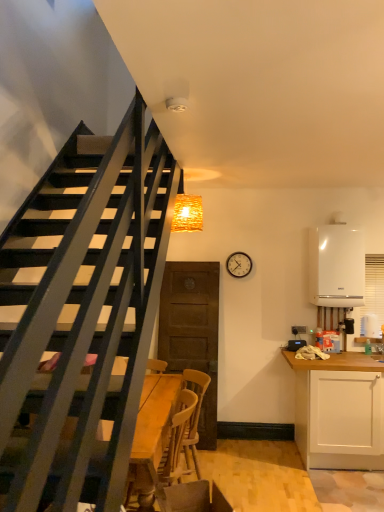
Question: Could you tell me if woven wood light fixture at upper center is turned towards metallic round clock at upper right?

Choices:
 (A) yes
 (B) no

Answer: (B)

Question: Is woven wood light fixture at upper center oriented away from metallic round clock at upper right?

Choices:
 (A) no
 (B) yes

Answer: (A)

Question: Is metallic round clock at upper right a part of woven wood light fixture at upper center?

Choices:
 (A) no
 (B) yes

Answer: (A)

Question: Does woven wood light fixture at upper center have a lesser height compared to metallic round clock at upper right?

Choices:
 (A) yes
 (B) no

Answer: (B)

Question: Is woven wood light fixture at upper center behind metallic round clock at upper right?

Choices:
 (A) yes
 (B) no

Answer: (B)

Question: From the image's perspective, is wooden swivel chair at lower center positioned above or below metallic round clock at upper right?

Choices:
 (A) below
 (B) above

Answer: (A)

Question: Is point click(220, 495) positioned closer to the camera than point click(248, 257)?

Choices:
 (A) farther
 (B) closer

Answer: (B)

Question: Considering the relative positions of wooden swivel chair at lower center and metallic round clock at upper right in the image provided, is wooden swivel chair at lower center to the left or to the right of metallic round clock at upper right?

Choices:
 (A) right
 (B) left

Answer: (B)

Question: Do you think wooden swivel chair at lower center is within metallic round clock at upper right, or outside of it?

Choices:
 (A) outside
 (B) inside

Answer: (A)

Question: Considering the relative positions of metallic round clock at upper right and white matte cabinet at right in the image provided, is metallic round clock at upper right to the left or to the right of white matte cabinet at right?

Choices:
 (A) right
 (B) left

Answer: (B)

Question: Is metallic round clock at upper right situated inside white matte cabinet at right or outside?

Choices:
 (A) inside
 (B) outside

Answer: (B)

Question: Is metallic round clock at upper right bigger or smaller than white matte cabinet at right?

Choices:
 (A) small
 (B) big

Answer: (A)

Question: In terms of height, does metallic round clock at upper right look taller or shorter compared to white matte cabinet at right?

Choices:
 (A) short
 (B) tall

Answer: (A)

Question: Is wooden swivel chair at lower center wider or thinner than white glossy boiler at right?

Choices:
 (A) thin
 (B) wide

Answer: (B)

Question: From a real-world perspective, is wooden swivel chair at lower center positioned above or below white glossy boiler at right?

Choices:
 (A) below
 (B) above

Answer: (A)